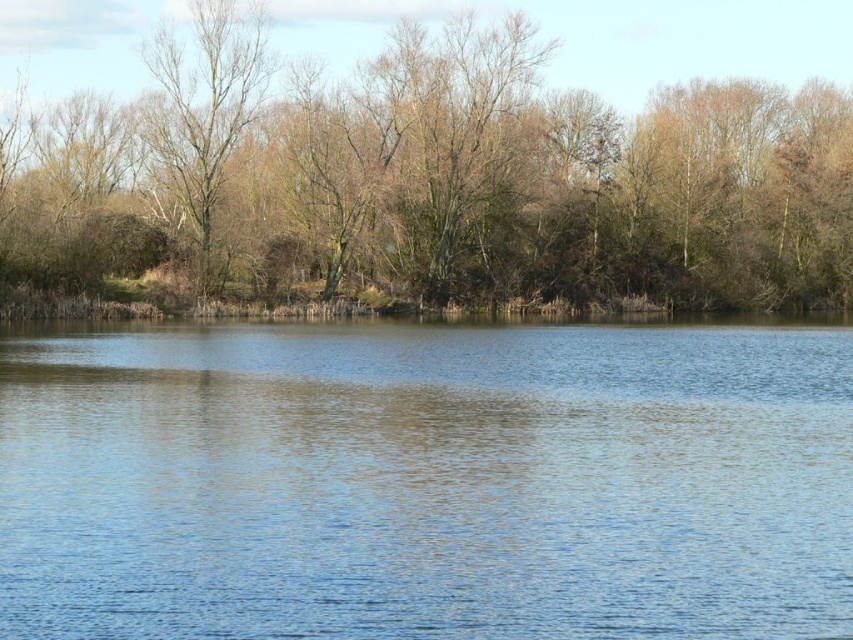
Question: Which is nearer to the brown leafless trees at upper center?

Choices:
 (A) bare branches at left
 (B) blue water at center

Answer: (A)

Question: Which point is farther to the camera?

Choices:
 (A) (16, 508)
 (B) (207, 198)
 (C) (788, 163)

Answer: (C)

Question: Is blue water at center closer to the viewer compared to bare branches at left?

Choices:
 (A) yes
 (B) no

Answer: (A)

Question: Can you confirm if brown leafless trees at upper center is wider than bare branches at left?

Choices:
 (A) no
 (B) yes

Answer: (B)

Question: Which of these objects is positioned farthest from the bare branches at left?

Choices:
 (A) brown leafless trees at upper center
 (B) blue water at center

Answer: (B)

Question: From the image, what is the correct spatial relationship of blue water at center in relation to bare branches at left?

Choices:
 (A) above
 (B) below

Answer: (B)